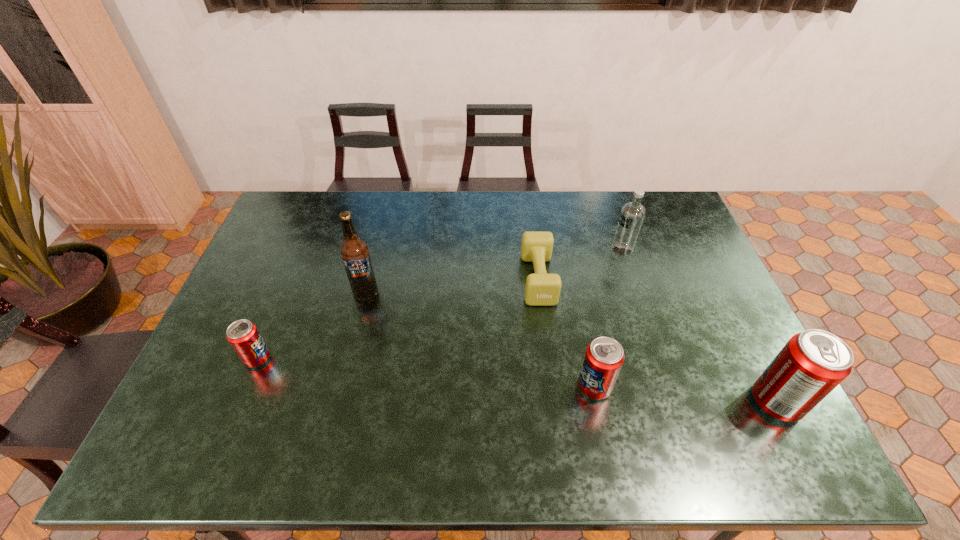
Locate an element on the screen. the fifth tallest object is located at coordinates (244, 337).

Where is `the leftmost soda can`? This screenshot has height=540, width=960. the leftmost soda can is located at coordinates (244, 337).

The image size is (960, 540). Identify the location of the second soda can from left to right. (604, 356).

Image resolution: width=960 pixels, height=540 pixels. I want to click on the fourth object from left to right, so click(x=604, y=356).

Locate an element on the screen. The height and width of the screenshot is (540, 960). the rightmost soda can is located at coordinates (814, 362).

I want to click on the tallest soda can, so click(814, 362).

In order to click on the second object from right to left in this screenshot , I will do pyautogui.click(x=632, y=214).

The image size is (960, 540). I want to click on the fifth object from right to left, so click(354, 251).

Identify the location of beer bottle. (354, 251).

Locate an element on the screen. The width and height of the screenshot is (960, 540). the shortest object is located at coordinates (542, 289).